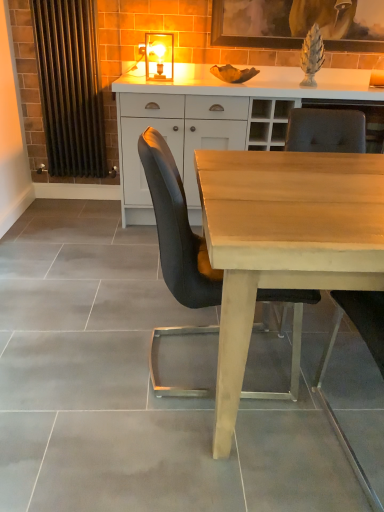
Question: From a real-world perspective, is matte glass lampshade at upper center on top of light brown wood desk at center?

Choices:
 (A) no
 (B) yes

Answer: (B)

Question: From a real-world perspective, does matte glass lampshade at upper center sit lower than light brown wood desk at center?

Choices:
 (A) no
 (B) yes

Answer: (A)

Question: Is matte glass lampshade at upper center not close to light brown wood desk at center?

Choices:
 (A) yes
 (B) no

Answer: (A)

Question: Is matte glass lampshade at upper center completely or partially outside of light brown wood desk at center?

Choices:
 (A) yes
 (B) no

Answer: (A)

Question: Is matte glass lampshade at upper center placed right next to light brown wood desk at center?

Choices:
 (A) yes
 (B) no

Answer: (B)

Question: Is matte glass lampshade at upper center further to camera compared to light brown wood desk at center?

Choices:
 (A) no
 (B) yes

Answer: (B)

Question: Is wooden picture frame at upper center looking in the opposite direction of matte wood chair at center, which is the second chair from left to right?

Choices:
 (A) no
 (B) yes

Answer: (A)

Question: Is wooden picture frame at upper center not close to matte wood chair at center, the 1th chair from the right?

Choices:
 (A) yes
 (B) no

Answer: (A)

Question: From the image's perspective, is wooden picture frame at upper center below matte wood chair at center, which is the second chair from left to right?

Choices:
 (A) yes
 (B) no

Answer: (B)

Question: Considering the relative positions of wooden picture frame at upper center and matte wood chair at center, the 1th chair from the right, in the image provided, is wooden picture frame at upper center in front of matte wood chair at center, the 1th chair from the right,?

Choices:
 (A) no
 (B) yes

Answer: (A)

Question: From a real-world perspective, is wooden picture frame at upper center physically below matte wood chair at center, the 1th chair from the right?

Choices:
 (A) no
 (B) yes

Answer: (A)

Question: Does wooden picture frame at upper center turn towards matte wood chair at center, which is the second chair from left to right?

Choices:
 (A) no
 (B) yes

Answer: (A)

Question: Is white matte cabinet at center located within matte black chair at center, which ranks as the first chair in left-to-right order?

Choices:
 (A) yes
 (B) no

Answer: (B)